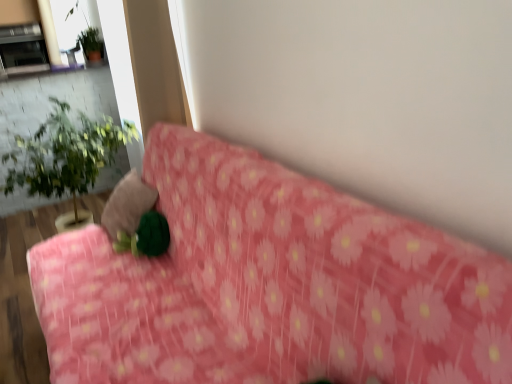
What do you see at coordinates (65, 154) in the screenshot? I see `green leafy plant at left` at bounding box center [65, 154].

At what (x,y) coordinates should I click in order to perform the action: click on metallic silver fireplace at upper left. Please return your answer as a coordinate pair (x, y). Looking at the image, I should click on (23, 49).

Where is `fireplace that appears on the left of velvety green pillow at center`? This screenshot has width=512, height=384. fireplace that appears on the left of velvety green pillow at center is located at coordinates (23, 49).

Consider the image. Is velvety green pillow at center situated inside metallic silver fireplace at upper left or outside?

velvety green pillow at center is not enclosed by metallic silver fireplace at upper left.

Considering the relative sizes of velvety green pillow at center and metallic silver fireplace at upper left in the image provided, is velvety green pillow at center bigger than metallic silver fireplace at upper left?

No.

From the image's perspective, is velvety green pillow at center above metallic silver fireplace at upper left?

No, from the image's perspective, velvety green pillow at center is not on top of metallic silver fireplace at upper left.

Which is behind, velvety green pillow at center or pink floral fabric at center?

velvety green pillow at center is further away from the camera.

At what (x,y) coordinates should I click in order to perform the action: click on pillow lying behind the pink floral fabric at center. Please return your answer as a coordinate pair (x, y). Image resolution: width=512 pixels, height=384 pixels. Looking at the image, I should click on (128, 205).

Is velvety green pillow at center taller or shorter than pink floral fabric at center?

velvety green pillow at center is shorter than pink floral fabric at center.

Is green matte plant at upper left oriented towards green leafy plant at left?

No, green matte plant at upper left is not facing towards green leafy plant at left.

From the image's perspective, between green matte plant at upper left and green leafy plant at left, which one is located above?

From the image's view, green matte plant at upper left is above.

Which object is further away from the camera taking this photo, green matte plant at upper left or green leafy plant at left?

green matte plant at upper left is further away from the camera.

Which is more to the left, green matte plant at upper left or green leafy plant at left?

Positioned to the left is green leafy plant at left.

From a real-world perspective, between pink floral fabric at center and metallic silver fireplace at upper left, who is vertically lower?

pink floral fabric at center, from a real-world perspective.

Would you say pink floral fabric at center is a long distance from metallic silver fireplace at upper left?

pink floral fabric at center is far away from metallic silver fireplace at upper left.

Between pink floral fabric at center and metallic silver fireplace at upper left, which one has larger width?

pink floral fabric at center.

Which of these two, pink floral fabric at center or green matte plant at upper left, stands taller?

pink floral fabric at center is taller.

Looking at their sizes, would you say pink floral fabric at center is wider or thinner than green matte plant at upper left?

pink floral fabric at center is wider than green matte plant at upper left.

Is pink floral fabric at center turned away from green matte plant at upper left?

No, pink floral fabric at center's orientation is not away from green matte plant at upper left.

Is pink floral fabric at center not close to green matte plant at upper left?

That's right, there is a large distance between pink floral fabric at center and green matte plant at upper left.

Would you say green leafy plant at left is part of metallic silver fireplace at upper left's contents?

No, metallic silver fireplace at upper left does not contain green leafy plant at left.

From the image's perspective, is metallic silver fireplace at upper left positioned above or below green leafy plant at left?

Based on their image positions, metallic silver fireplace at upper left is located above green leafy plant at left.

I want to click on houseplant below the metallic silver fireplace at upper left (from a real-world perspective), so click(65, 154).

Which of these two, metallic silver fireplace at upper left or green leafy plant at left, is thinner?

metallic silver fireplace at upper left is thinner.

How different are the orientations of green matte plant at upper left and velvety green pillow at center in degrees?

There is a 90-degree angle between the facing directions of green matte plant at upper left and velvety green pillow at center.

Locate an element on the screen. pillow below the green matte plant at upper left (from a real-world perspective) is located at coordinates (128, 205).

Can velvety green pillow at center be found inside green matte plant at upper left?

That's incorrect, velvety green pillow at center is not inside green matte plant at upper left.

The width and height of the screenshot is (512, 384). In order to click on fireplace that is on the left side of velvety green pillow at center in this screenshot , I will do click(23, 49).

The image size is (512, 384). I want to click on furniture that appears below the velvety green pillow at center (from a real-world perspective), so click(269, 286).

Which object lies further to the anchor point metallic silver fireplace at upper left, green matte plant at upper left or velvety green pillow at center?

Based on the image, velvety green pillow at center appears to be further to metallic silver fireplace at upper left.

From the image, which object appears to be farther from pink floral fabric at center, green matte plant at upper left or velvety green pillow at center?

Among the two, green matte plant at upper left is located further to pink floral fabric at center.

From the image, which object appears to be nearer to green matte plant at upper left, velvety green pillow at center or green leafy plant at left?

The object closer to green matte plant at upper left is green leafy plant at left.

When comparing their distances from green matte plant at upper left, does metallic silver fireplace at upper left or green leafy plant at left seem further?

green leafy plant at left lies further to green matte plant at upper left than the other object.

Based on their spatial positions, is green leafy plant at left or metallic silver fireplace at upper left further from pink floral fabric at center?

metallic silver fireplace at upper left is positioned further to the anchor pink floral fabric at center.

Which object lies further to the anchor point green matte plant at upper left, pink floral fabric at center or metallic silver fireplace at upper left?

Among the two, pink floral fabric at center is located further to green matte plant at upper left.

Considering their positions, is green matte plant at upper left positioned further to green leafy plant at left than velvety green pillow at center?

velvety green pillow at center is further to green leafy plant at left.

Looking at the image, which one is located further to green leafy plant at left, velvety green pillow at center or metallic silver fireplace at upper left?

metallic silver fireplace at upper left.

Locate an element on the screen. houseplant between velvety green pillow at center and metallic silver fireplace at upper left in the front-back direction is located at coordinates (65, 154).

Locate an element on the screen. The height and width of the screenshot is (384, 512). pillow between pink floral fabric at center and green leafy plant at left from front to back is located at coordinates (128, 205).

This screenshot has width=512, height=384. What are the coordinates of `houseplant between velvety green pillow at center and green matte plant at upper left in the front-back direction` in the screenshot? It's located at (65, 154).

What are the coordinates of `plant between green leafy plant at left and metallic silver fireplace at upper left from front to back` in the screenshot? It's located at (86, 32).